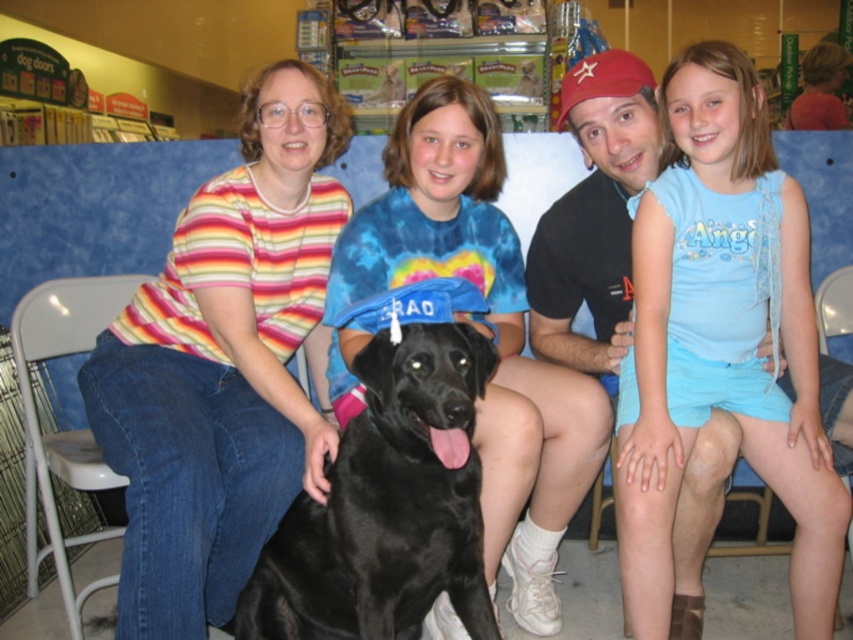
Based on the coordinates provided, where is the light blue sleeveless shirt at upper right located in the image?

The light blue sleeveless shirt at upper right is located at the coordinates point (723, 337).

How does the size of the striped cotton shirt at left compare to the black matte dog at center?

The striped cotton shirt at left is larger in size than the black matte dog at center.